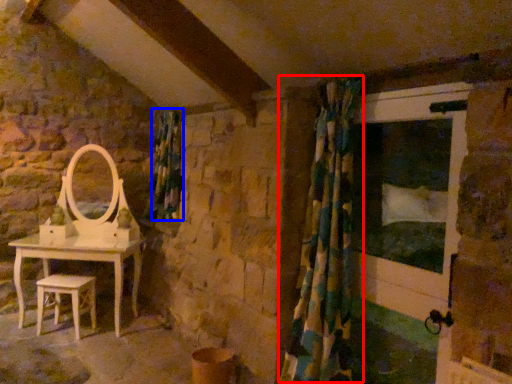
Question: Which point is further to the camera, shower curtain (highlighted by a red box) or curtain (highlighted by a blue box)?

Choices:
 (A) shower curtain
 (B) curtain

Answer: (B)